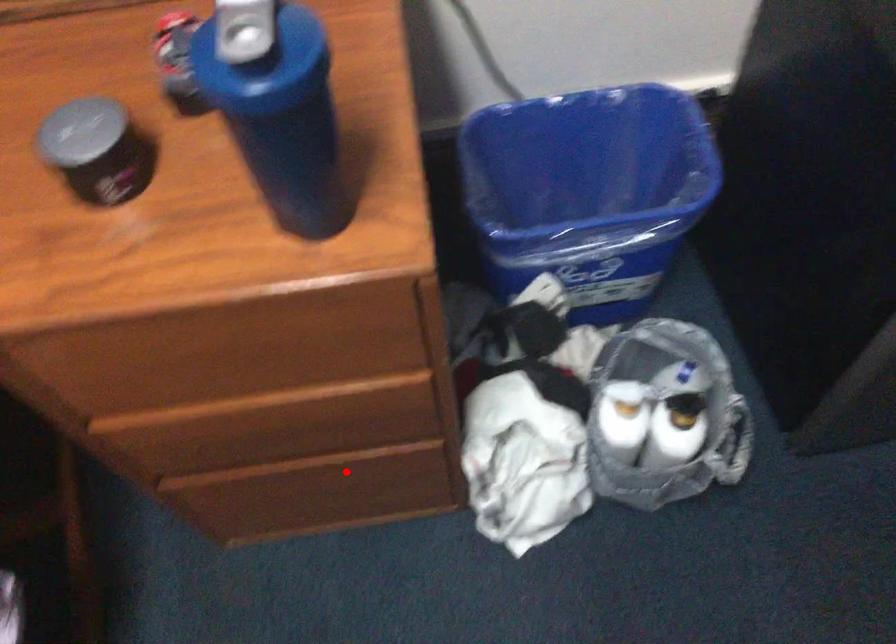
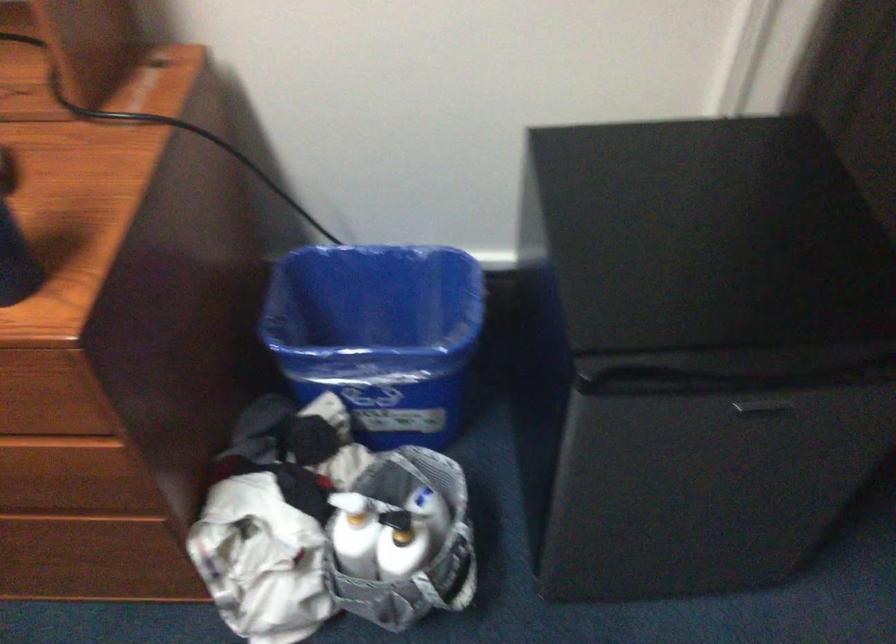
The point at the highlighted location is marked in the first image. Where is the corresponding point in the second image?

(83, 533)